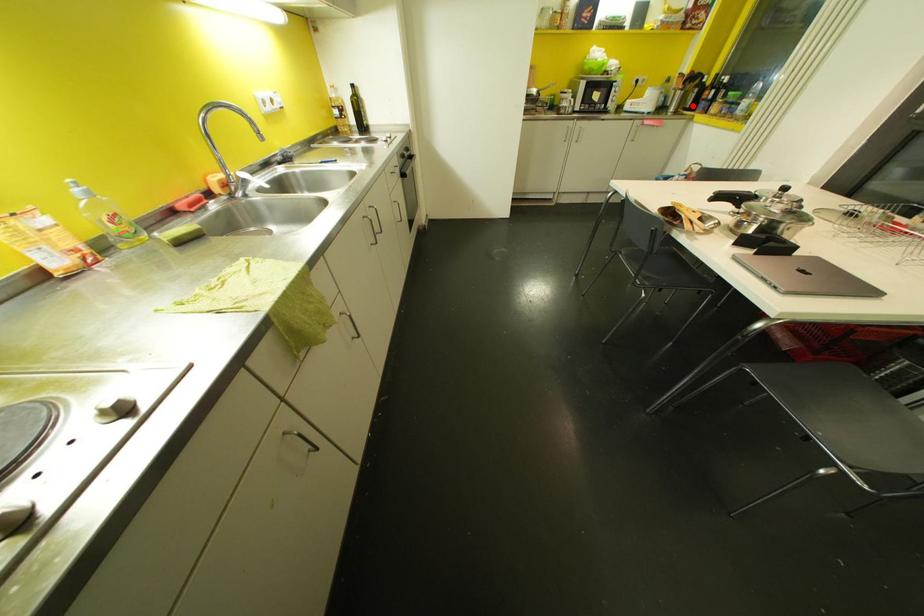
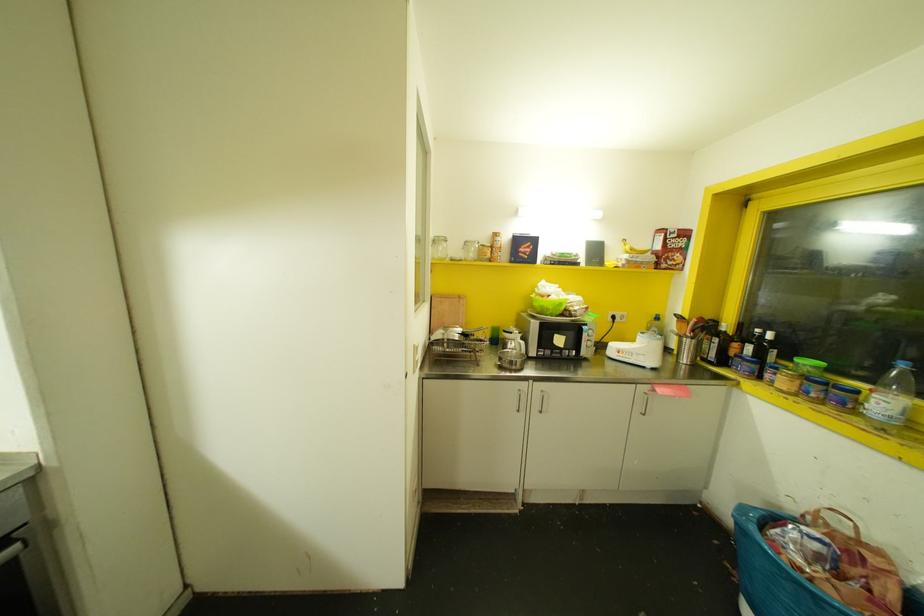
Question: I am providing you with two images of the same scene from different viewpoints. A red point is marked on the first image. At the location where the point appears in image 1, is it still visible in image 2?

Choices:
 (A) Yes
 (B) No

Answer: (A)